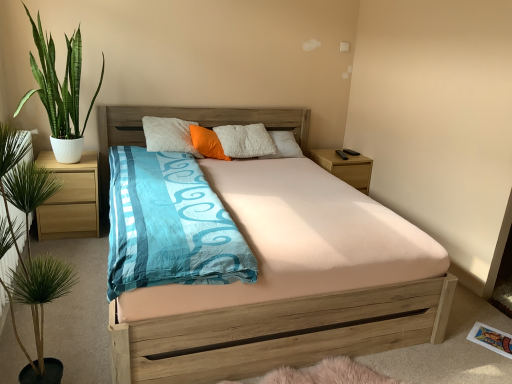
Question: Considering the relative positions of green glossy plant at left, which is the 1th houseplant in top-to-bottom order, and wooden nightstand at right, which is the 2th nightstand from left to right, in the image provided, is green glossy plant at left, which is the 1th houseplant in top-to-bottom order, to the left of wooden nightstand at right, which is the 2th nightstand from left to right, from the viewer's perspective?

Choices:
 (A) yes
 (B) no

Answer: (A)

Question: Considering the relative sizes of green glossy plant at left, placed as the 1th houseplant when sorted from back to front, and wooden nightstand at right, which is the 2th nightstand from left to right, in the image provided, is green glossy plant at left, placed as the 1th houseplant when sorted from back to front, bigger than wooden nightstand at right, which is the 2th nightstand from left to right,?

Choices:
 (A) no
 (B) yes

Answer: (B)

Question: Considering the relative sizes of green glossy plant at left, marked as the 2th houseplant in a front-to-back arrangement, and wooden nightstand at right, which is the 1th nightstand in back-to-front order, in the image provided, is green glossy plant at left, marked as the 2th houseplant in a front-to-back arrangement, shorter than wooden nightstand at right, which is the 1th nightstand in back-to-front order,?

Choices:
 (A) yes
 (B) no

Answer: (B)

Question: Considering the relative sizes of green glossy plant at left, the second houseplant when ordered from bottom to top, and wooden nightstand at right, which is the 1th nightstand in back-to-front order, in the image provided, is green glossy plant at left, the second houseplant when ordered from bottom to top, thinner than wooden nightstand at right, which is the 1th nightstand in back-to-front order,?

Choices:
 (A) no
 (B) yes

Answer: (A)

Question: From a real-world perspective, does green glossy plant at left, the second houseplant when ordered from bottom to top, sit lower than wooden nightstand at right, which is the 1th nightstand in back-to-front order?

Choices:
 (A) no
 (B) yes

Answer: (A)

Question: Is wooden nightstand at right, acting as the 1th nightstand starting from the right, bigger or smaller than orange soft pillow at center?

Choices:
 (A) small
 (B) big

Answer: (B)

Question: Considering the positions of wooden nightstand at right, which is the 1th nightstand in back-to-front order, and orange soft pillow at center in the image, is wooden nightstand at right, which is the 1th nightstand in back-to-front order, wider or thinner than orange soft pillow at center?

Choices:
 (A) thin
 (B) wide

Answer: (B)

Question: From a real-world perspective, is wooden nightstand at right, which is the 2th nightstand from left to right, physically located above or below orange soft pillow at center?

Choices:
 (A) above
 (B) below

Answer: (B)

Question: Would you say wooden nightstand at right, which is the 1th nightstand in back-to-front order, is to the left or to the right of orange soft pillow at center in the picture?

Choices:
 (A) left
 (B) right

Answer: (B)

Question: From a real-world perspective, is light brown wood at left, the first nightstand when ordered from front to back, physically located above or below wooden nightstand at right, which is the 1th nightstand in back-to-front order?

Choices:
 (A) above
 (B) below

Answer: (B)

Question: From the image's perspective, relative to wooden nightstand at right, which is the 1th nightstand in back-to-front order, is light brown wood at left, the 2th nightstand viewed from the back, above or below?

Choices:
 (A) below
 (B) above

Answer: (A)

Question: In the image, is light brown wood at left, the first nightstand when ordered from front to back, positioned in front of or behind wooden nightstand at right, which is the second nightstand from front to back?

Choices:
 (A) front
 (B) behind

Answer: (A)

Question: From their relative heights in the image, would you say light brown wood at left, marked as the first nightstand in a left-to-right arrangement, is taller or shorter than wooden nightstand at right, which is the 2th nightstand from left to right?

Choices:
 (A) tall
 (B) short

Answer: (A)

Question: In the image, is orange soft pillow at center positioned in front of or behind green glossy plant at left, placed as the 1th houseplant when sorted from back to front?

Choices:
 (A) behind
 (B) front

Answer: (A)

Question: Is orange soft pillow at center situated inside green glossy plant at left, marked as the 2th houseplant in a front-to-back arrangement, or outside?

Choices:
 (A) outside
 (B) inside

Answer: (A)